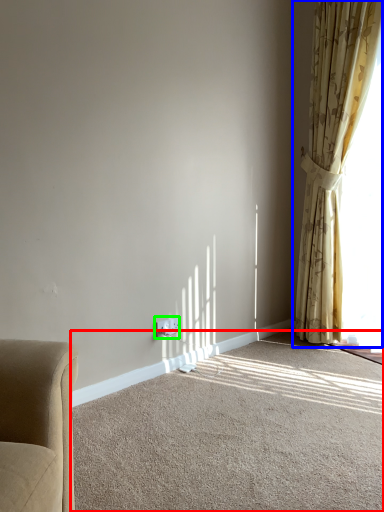
Question: Considering the real-world distances, which object is farthest from plain (highlighted by a red box)? curtain (highlighted by a blue box) or electric outlet (highlighted by a green box)?

Choices:
 (A) curtain
 (B) electric outlet

Answer: (A)